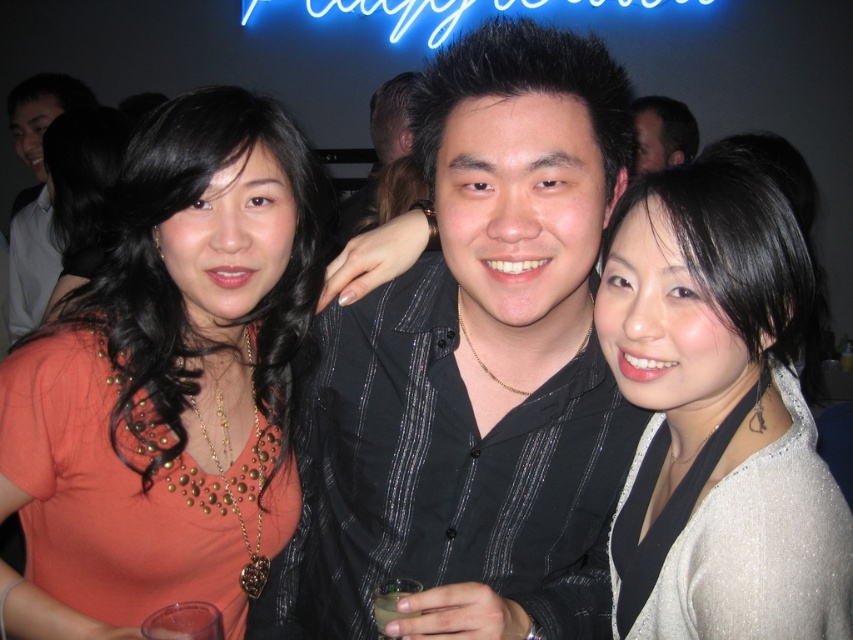
Question: Which of these objects is positioned farthest from the clear plastic cup at center?

Choices:
 (A) matte black shirt at center
 (B) satin silver blouse at right
 (C) black textured shirt at center

Answer: (A)

Question: Which of the following is the closest to the observer?

Choices:
 (A) black textured shirt at center
 (B) matte black shirt at upper center
 (C) matte black shirt at center

Answer: (A)

Question: Considering the relative positions of orange fabric shirt at center and satin silver blouse at right in the image provided, where is orange fabric shirt at center located with respect to satin silver blouse at right?

Choices:
 (A) left
 (B) right

Answer: (A)

Question: Is black striped shirt at center to the left of satin silver blouse at right from the viewer's perspective?

Choices:
 (A) no
 (B) yes

Answer: (B)

Question: Estimate the real-world distances between objects in this image. Which object is closer to the satin silver blouse at right?

Choices:
 (A) orange fabric shirt at center
 (B) clear plastic cup at center

Answer: (B)

Question: Can you confirm if black striped shirt at center is thinner than matte black shirt at upper center?

Choices:
 (A) no
 (B) yes

Answer: (A)